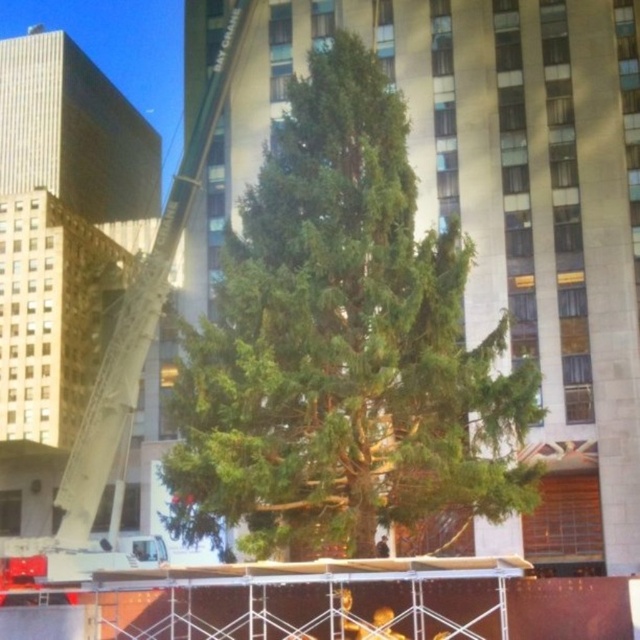
Which of these two, green needle-like at center or white metal crane at center, stands taller?

Standing taller between the two is white metal crane at center.

Does green needle-like at center appear over white metal crane at center?

No, green needle-like at center is not above white metal crane at center.

Where is `green needle-like at center`? The image size is (640, 640). green needle-like at center is located at coordinates (340, 346).

Who is taller, green needle-like at center or dark blue uniform at center?

With more height is green needle-like at center.

Describe the element at coordinates (340, 346) in the screenshot. I see `green needle-like at center` at that location.

Where is `green needle-like at center`? This screenshot has width=640, height=640. green needle-like at center is located at coordinates (340, 346).

Can you confirm if white metal crane at center is positioned to the left of dark blue uniform at center?

Indeed, white metal crane at center is positioned on the left side of dark blue uniform at center.

Based on the photo, can you confirm if white metal crane at center is positioned above dark blue uniform at center?

Yes, white metal crane at center is above dark blue uniform at center.

In order to click on white metal crane at center in this screenshot , I will do `click(131, 339)`.